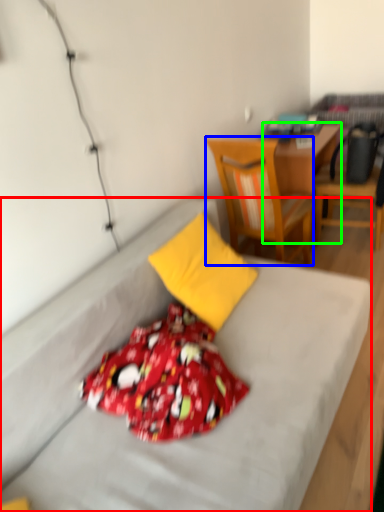
Question: Estimate the real-world distances between objects in this image. Which object is farther from bed (highlighted by a red box), chair (highlighted by a blue box) or desk (highlighted by a green box)?

Choices:
 (A) chair
 (B) desk

Answer: (B)